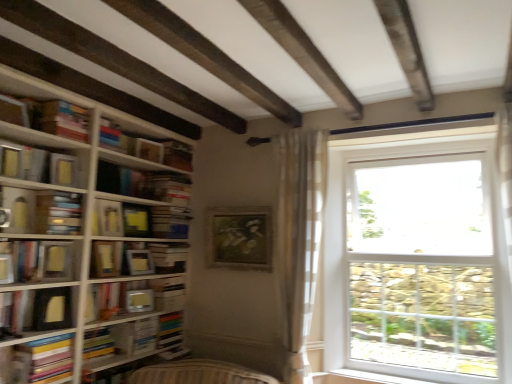
Question: From a real-world perspective, is hardcover book at lower left, the 4th book viewed from the top, positioned above or below matte yellow book at left, which is the 1th book in top-to-bottom order?

Choices:
 (A) below
 (B) above

Answer: (A)

Question: Is hardcover book at lower left, the first book positioned from the bottom, to the left or to the right of matte yellow book at left, which is the 4th book in bottom-to-top order, in the image?

Choices:
 (A) right
 (B) left

Answer: (A)

Question: Which is nearer to the white plastic window sill at lower right?

Choices:
 (A) matte yellow book at left, which is the 1th book in top-to-bottom order
 (B) matte black book at upper center, which is the 1th paperback book from top to bottom
 (C) hardcover book at lower left, the 4th book viewed from the top
 (D) hardcover book at left, marked as the 1th paperback book in a bottom-to-top arrangement
 (E) white wood bookcase at left

Answer: (C)

Question: Based on their relative distances, which object is nearer to the matte yellow paperback at center-left, marked as the fourth paperback book in a bottom-to-top arrangement?

Choices:
 (A) white cardboard book at center, which is the second book from bottom to top
 (B) clear glass window at right
 (C) white plastic window sill at lower right
 (D) yellow matte paper at center, which is the 6th paperback book from bottom to top
 (E) hardcover book at lower left, the first book positioned from the bottom

Answer: (D)